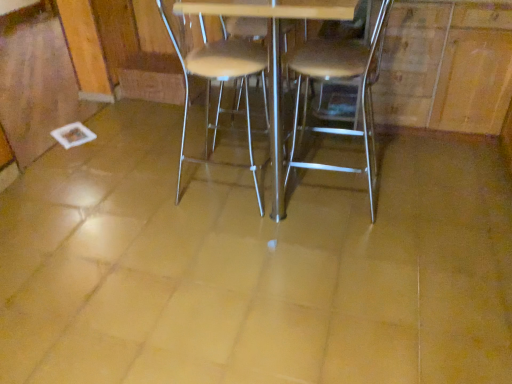
Find the location of `vacant area that is in front of metallic silver chair at center, which appears as the first chair when viewed from the left`. vacant area that is in front of metallic silver chair at center, which appears as the first chair when viewed from the left is located at coordinates (228, 239).